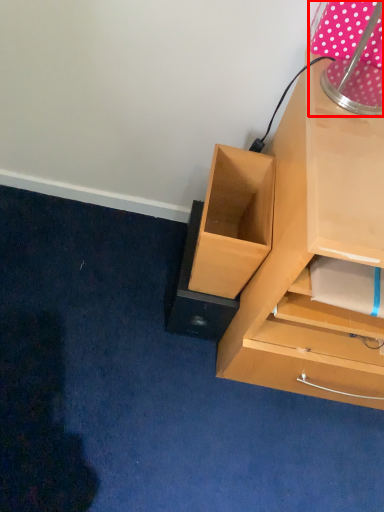
Question: Where is table lamp (annotated by the red box) located in relation to drawer in the image?

Choices:
 (A) left
 (B) right

Answer: (B)